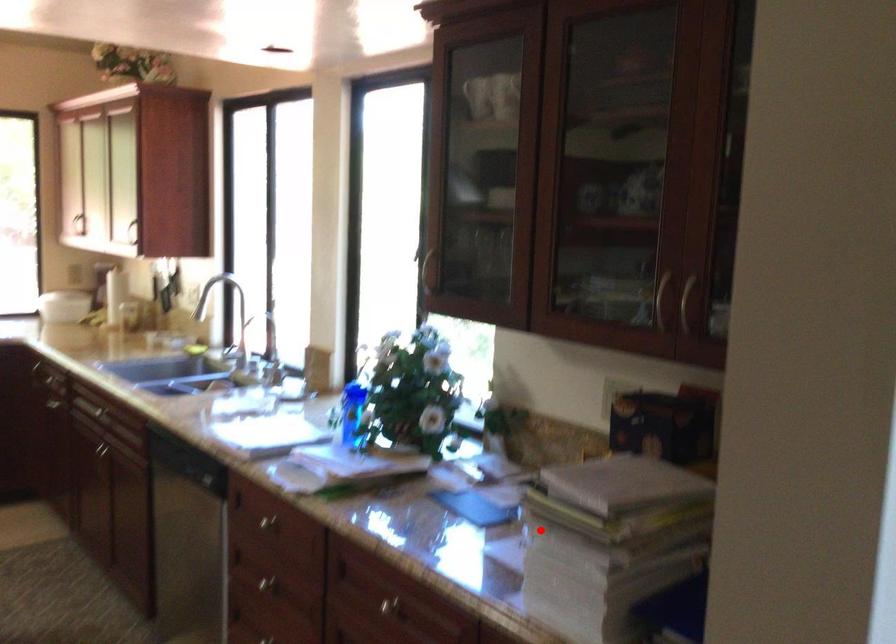
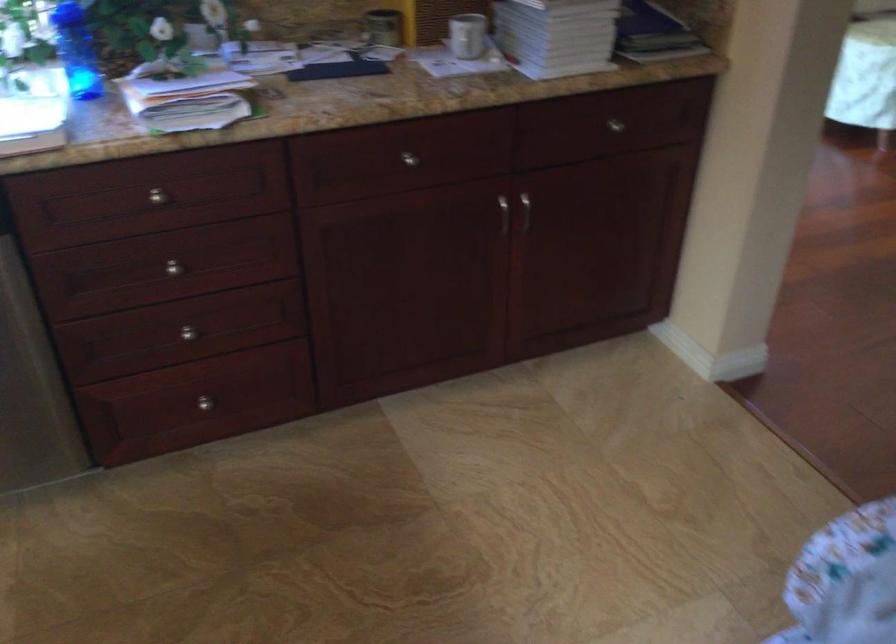
Question: A red point is marked in image1. In image2, is the corresponding 3D point closer to the camera or farther? Reply with the corresponding letter.

Choices:
 (A) The corresponding 3D point is closer.
 (B) The corresponding 3D point is farther.

Answer: (B)